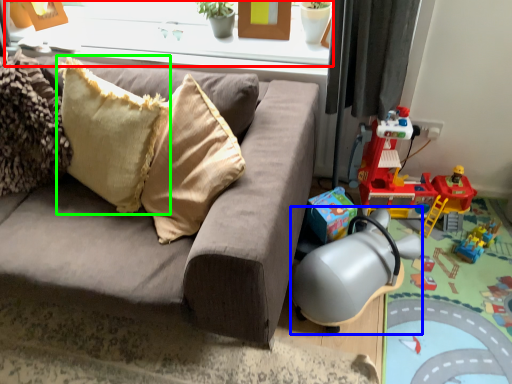
Question: Which is farther away from window frame (highlighted by a red box)? swivel chair (highlighted by a blue box) or pillow (highlighted by a green box)?

Choices:
 (A) swivel chair
 (B) pillow

Answer: (A)